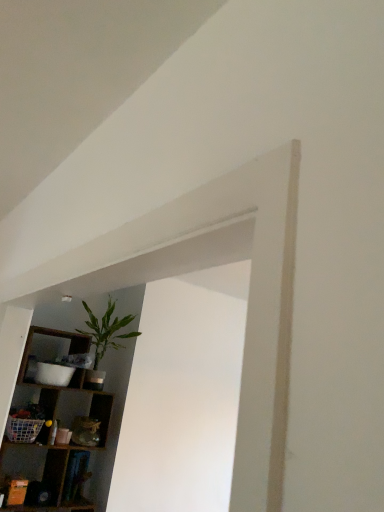
Question: Does green leafy plant at upper left appear on the left side of wooden shelf at left?

Choices:
 (A) no
 (B) yes

Answer: (A)

Question: From a real-world perspective, is green leafy plant at upper left physically above wooden shelf at left?

Choices:
 (A) yes
 (B) no

Answer: (A)

Question: Is green leafy plant at upper left shorter than wooden shelf at left?

Choices:
 (A) no
 (B) yes

Answer: (B)

Question: Can you confirm if green leafy plant at upper left is wider than wooden shelf at left?

Choices:
 (A) yes
 (B) no

Answer: (B)

Question: From the image's perspective, is green leafy plant at upper left located above wooden shelf at left?

Choices:
 (A) no
 (B) yes

Answer: (B)

Question: Are green leafy plant at upper left and wooden shelf at left located far from each other?

Choices:
 (A) yes
 (B) no

Answer: (B)

Question: Is wooden shelf at left thinner than green leafy plant at upper left?

Choices:
 (A) no
 (B) yes

Answer: (A)

Question: Are wooden shelf at left and green leafy plant at upper left beside each other?

Choices:
 (A) yes
 (B) no

Answer: (B)

Question: Does wooden shelf at left appear on the left side of green leafy plant at upper left?

Choices:
 (A) yes
 (B) no

Answer: (A)

Question: Is wooden shelf at left outside green leafy plant at upper left?

Choices:
 (A) yes
 (B) no

Answer: (A)

Question: Considering the relative positions of wooden shelf at left and green leafy plant at upper left in the image provided, is wooden shelf at left to the right of green leafy plant at upper left from the viewer's perspective?

Choices:
 (A) yes
 (B) no

Answer: (B)

Question: Does wooden shelf at left have a lesser height compared to green leafy plant at upper left?

Choices:
 (A) no
 (B) yes

Answer: (A)

Question: From the image's perspective, relative to wooden shelf at left, is green leafy plant at upper left above or below?

Choices:
 (A) above
 (B) below

Answer: (A)